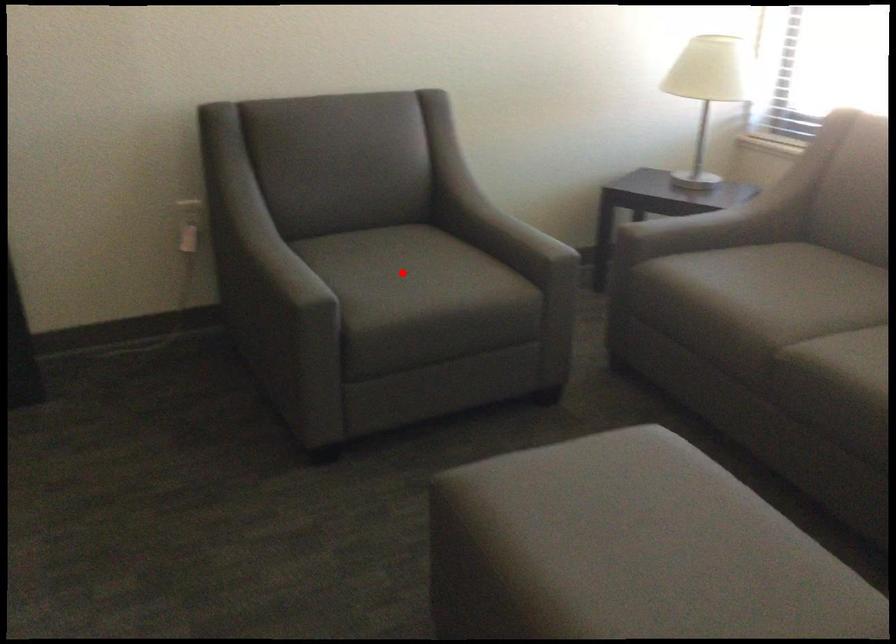
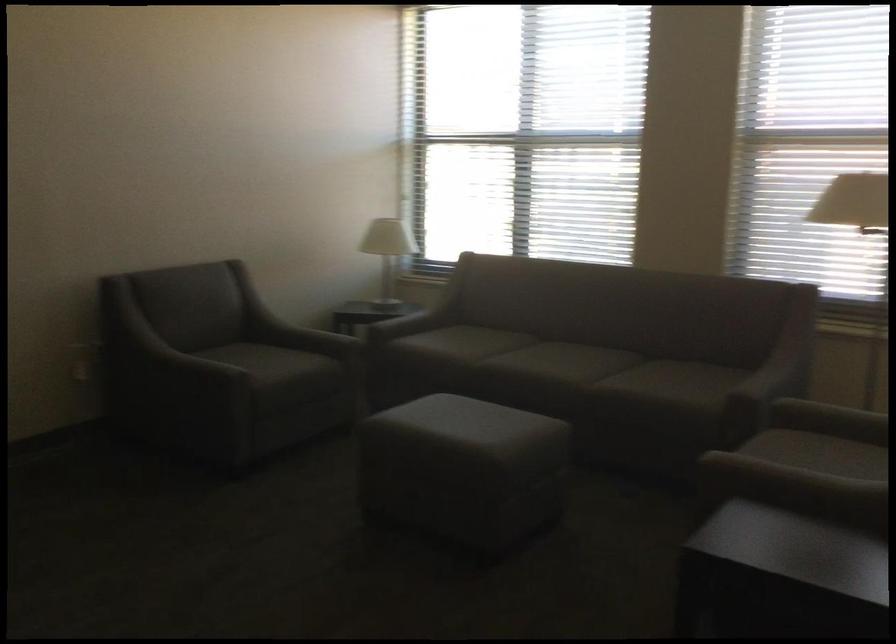
In the second image, find the point that corresponds to the highlighted location in the first image.

(259, 359)